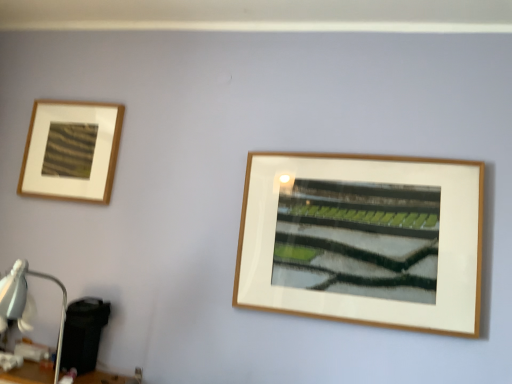
Question: Should I look upward or downward to see matte white table lamp at lower left?

Choices:
 (A) down
 (B) up

Answer: (A)

Question: Is the depth of matte white table lamp at lower left less than that of wooden table at lower left?

Choices:
 (A) yes
 (B) no

Answer: (A)

Question: Is matte white table lamp at lower left located outside wooden table at lower left?

Choices:
 (A) yes
 (B) no

Answer: (A)

Question: Considering the relative sizes of matte white table lamp at lower left and wooden table at lower left in the image provided, is matte white table lamp at lower left taller than wooden table at lower left?

Choices:
 (A) yes
 (B) no

Answer: (A)

Question: Considering the relative positions of matte white table lamp at lower left and wooden table at lower left in the image provided, is matte white table lamp at lower left to the right of wooden table at lower left from the viewer's perspective?

Choices:
 (A) no
 (B) yes

Answer: (B)

Question: From the image's perspective, is matte white table lamp at lower left above wooden table at lower left?

Choices:
 (A) yes
 (B) no

Answer: (A)

Question: Can you confirm if matte white table lamp at lower left is thinner than wooden table at lower left?

Choices:
 (A) yes
 (B) no

Answer: (B)

Question: Is matte white table lamp at lower left smaller than matte wood picture frame at upper left?

Choices:
 (A) no
 (B) yes

Answer: (A)

Question: From the image's perspective, is matte white table lamp at lower left located above matte wood picture frame at upper left?

Choices:
 (A) yes
 (B) no

Answer: (B)

Question: Considering the relative sizes of matte white table lamp at lower left and matte wood picture frame at upper left in the image provided, is matte white table lamp at lower left thinner than matte wood picture frame at upper left?

Choices:
 (A) no
 (B) yes

Answer: (A)

Question: Is matte white table lamp at lower left far from matte wood picture frame at upper left?

Choices:
 (A) no
 (B) yes

Answer: (A)

Question: Does matte white table lamp at lower left have a greater height compared to matte wood picture frame at upper left?

Choices:
 (A) no
 (B) yes

Answer: (B)

Question: From a real-world perspective, is matte white table lamp at lower left physically below matte wood picture frame at upper left?

Choices:
 (A) no
 (B) yes

Answer: (B)

Question: From a real-world perspective, is matte wood picture frame at upper left beneath matte white table lamp at lower left?

Choices:
 (A) no
 (B) yes

Answer: (A)